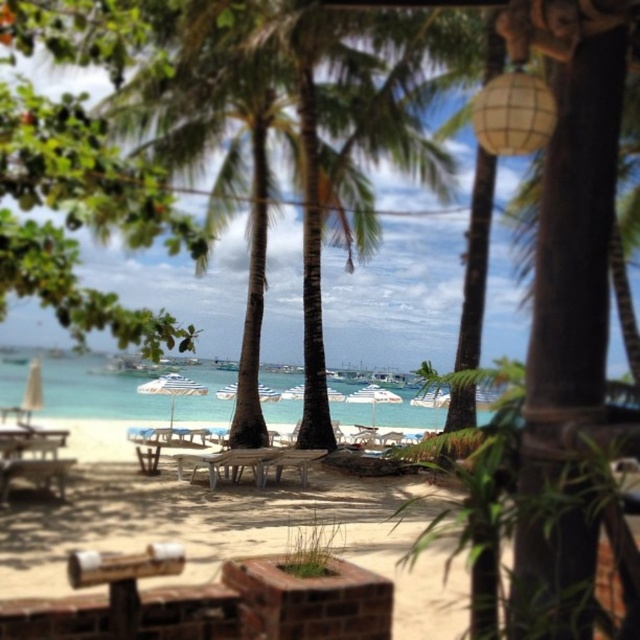
You are standing at the shaded area near the shore and want to take a photo of two points marked in the scene. The first point is at coordinate point [60,496] and the second is at point [300,467]. Which point will appear larger in your photo?

Point [60,496] is closer to the camera than point [300,467], so it will appear larger in the photo.

You are planning to set up a small tent between the clear blue water at center and the white wood picnic table at center. Based on their widths, can you determine which side of the tent should be closer to the water to ensure it fits comfortably?

The clear blue water at center might be wider than the white wood picnic table at center, so placing the tent closer to the picnic table would leave more space on the water side, ensuring it fits comfortably.